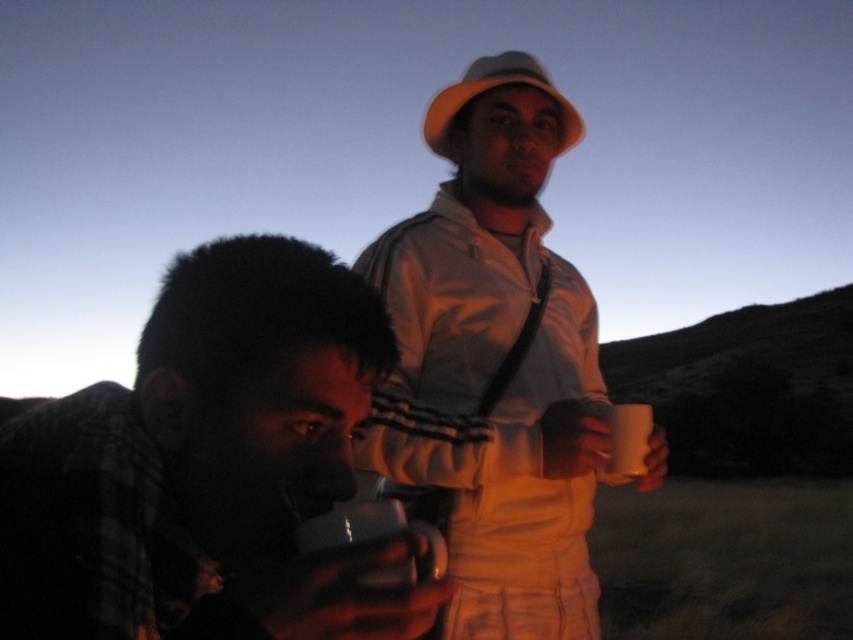
Does white glossy mug at lower center have a smaller size compared to white matte mug at upper center?

Incorrect, white glossy mug at lower center is not smaller in size than white matte mug at upper center.

Between white glossy mug at lower center and white matte mug at upper center, which one has less height?

Standing shorter between the two is white matte mug at upper center.

You are a GUI agent. You are given a task and a screenshot of the screen. Output one action in this format:
    pyautogui.click(x=<x>, y=<y>)
    Task: Click on the white glossy mug at lower center
    
    Given the screenshot: What is the action you would take?
    pyautogui.click(x=375, y=538)

Can you confirm if white matte jacket at center is bigger than white matte mug at upper center?

Indeed, white matte jacket at center has a larger size compared to white matte mug at upper center.

Based on the photo, is white matte jacket at center below white matte mug at upper center?

No, white matte jacket at center is not below white matte mug at upper center.

This screenshot has height=640, width=853. What do you see at coordinates (494, 364) in the screenshot? I see `white matte jacket at center` at bounding box center [494, 364].

At what (x,y) coordinates should I click in order to perform the action: click on white matte jacket at center. Please return your answer as a coordinate pair (x, y). Looking at the image, I should click on (494, 364).

How much distance is there between matte black mug at lower left and white matte mug at upper center?

matte black mug at lower left is 37.63 inches from white matte mug at upper center.

Does matte black mug at lower left come behind white matte mug at upper center?

No, matte black mug at lower left is closer to the viewer.

Is point (177, 387) closer to camera compared to point (640, 422)?

Yes.

The width and height of the screenshot is (853, 640). What are the coordinates of `matte black mug at lower left` in the screenshot? It's located at (273, 428).